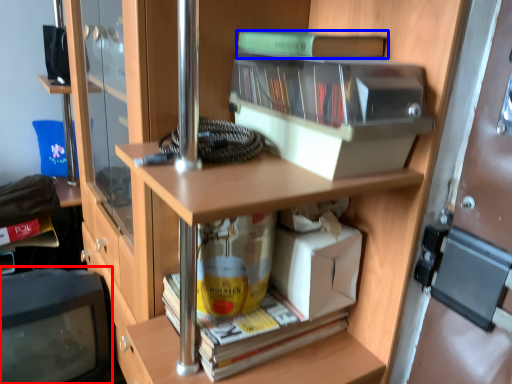
Question: Among these objects, which one is farthest to the camera, computer monitor (highlighted by a red box) or book (highlighted by a blue box)?

Choices:
 (A) computer monitor
 (B) book

Answer: (A)